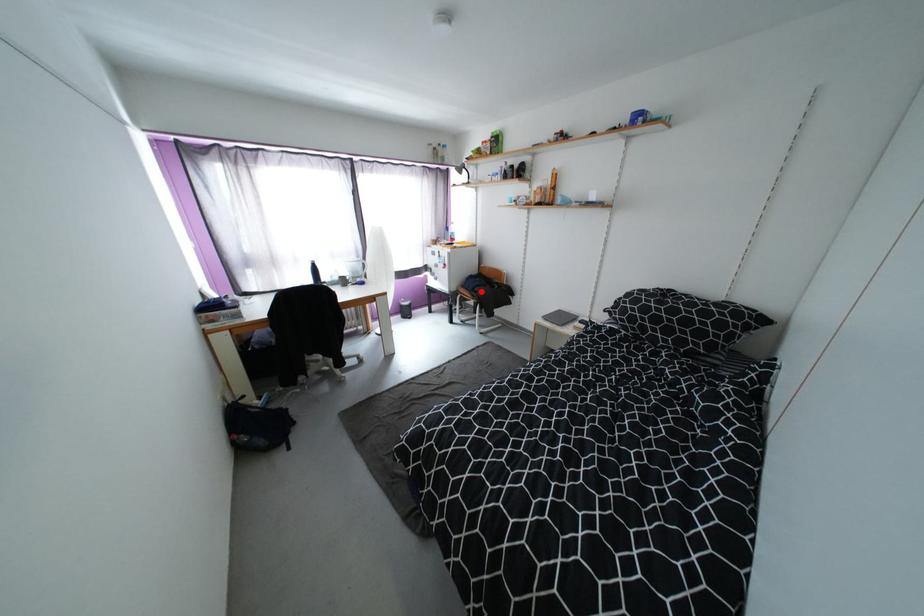
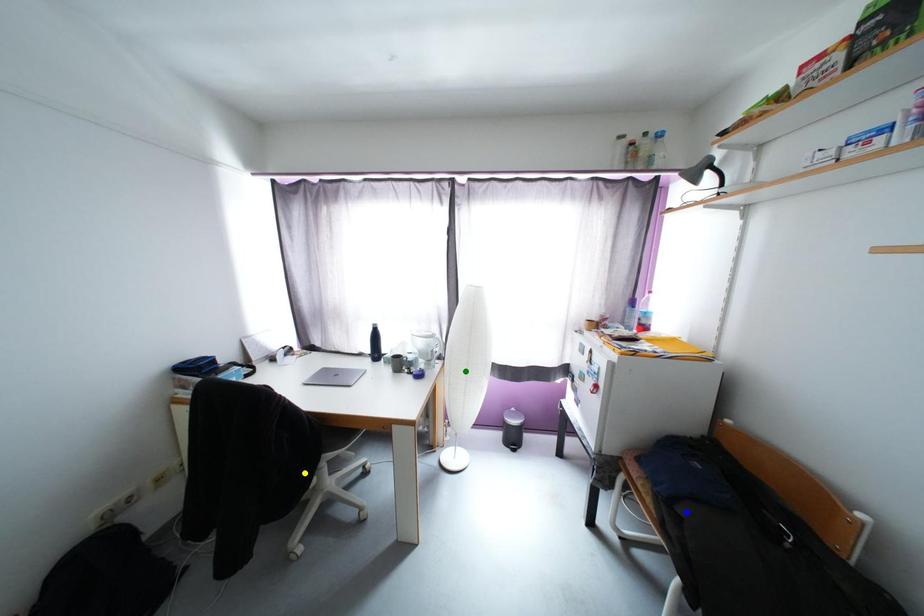
Question: I am providing you with two images of the same scene from different viewpoints. A red point is marked on the first image. You are given multiple points on the second image. Can you choose the point in image 2 that corresponds to the point in image 1?

Choices:
 (A) green point
 (B) yellow point
 (C) blue point

Answer: (C)